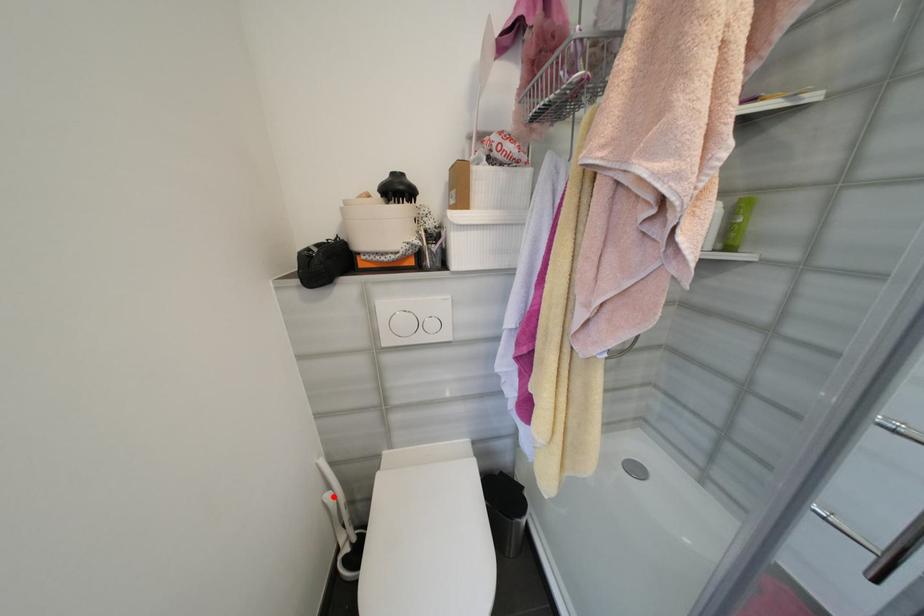
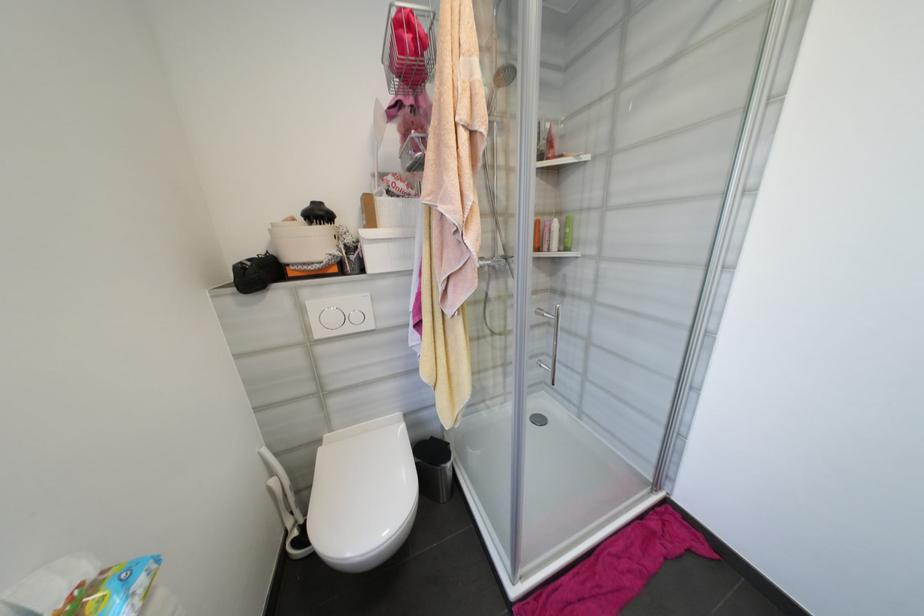
Locate, in the second image, the point that corresponds to the highlighted location in the first image.

(277, 482)